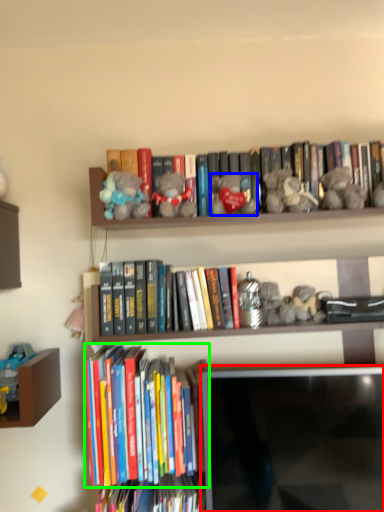
Question: Based on their relative distances, which object is farther from computer monitor (highlighted by a red box)? Choose from toy (highlighted by a blue box) and book (highlighted by a green box).

Choices:
 (A) toy
 (B) book

Answer: (A)